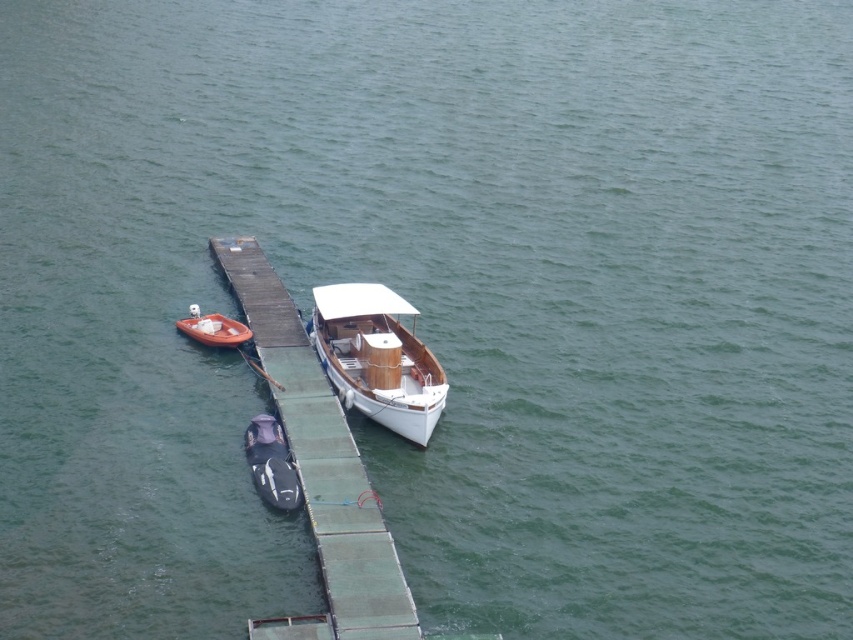
Question: Which of the following is the closest to the observer?

Choices:
 (A) white wood boat at center
 (B) black rubber kayak at center
 (C) orange matte boat at left

Answer: (B)

Question: Which point appears closest to the camera in this image?

Choices:
 (A) click(x=196, y=310)
 (B) click(x=291, y=305)
 (C) click(x=286, y=497)
 (D) click(x=364, y=404)

Answer: (C)

Question: Is the position of black rubber kayak at center more distant than that of orange matte boat at left?

Choices:
 (A) yes
 (B) no

Answer: (B)

Question: Which of the following is the closest to the observer?

Choices:
 (A) orange matte boat at left
 (B) white wood boat at center
 (C) green wooden dock at center
 (D) black rubber kayak at center

Answer: (C)

Question: Is green wooden dock at center further to camera compared to orange matte boat at left?

Choices:
 (A) no
 (B) yes

Answer: (A)

Question: Does green wooden dock at center appear on the left side of white wood boat at center?

Choices:
 (A) no
 (B) yes

Answer: (B)